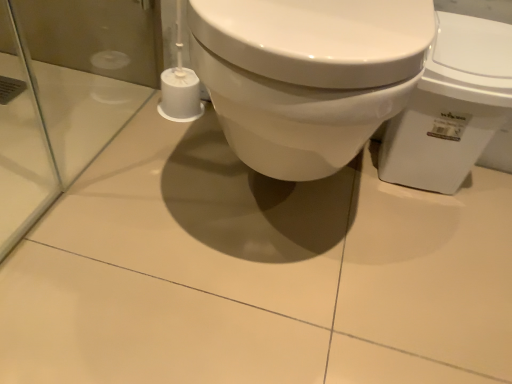
Question: Looking at their shapes, would you say white glossy toilet at right is wider or thinner than white matte toilet paper at lower left?

Choices:
 (A) thin
 (B) wide

Answer: (B)

Question: From the image's perspective, is white glossy toilet at right positioned above or below white matte toilet paper at lower left?

Choices:
 (A) above
 (B) below

Answer: (B)

Question: Does point (506, 39) appear closer or farther from the camera than point (180, 102)?

Choices:
 (A) farther
 (B) closer

Answer: (B)

Question: Visually, is white matte toilet paper at lower left positioned to the left or to the right of white glossy toilet at right?

Choices:
 (A) right
 (B) left

Answer: (B)

Question: In the image, is white matte toilet paper at lower left positioned in front of or behind white glossy toilet at right?

Choices:
 (A) behind
 (B) front

Answer: (A)

Question: Is white matte toilet paper at lower left taller or shorter than white glossy toilet at right?

Choices:
 (A) tall
 (B) short

Answer: (B)

Question: Is white matte toilet paper at lower left spatially inside white glossy toilet at right, or outside of it?

Choices:
 (A) inside
 (B) outside

Answer: (B)